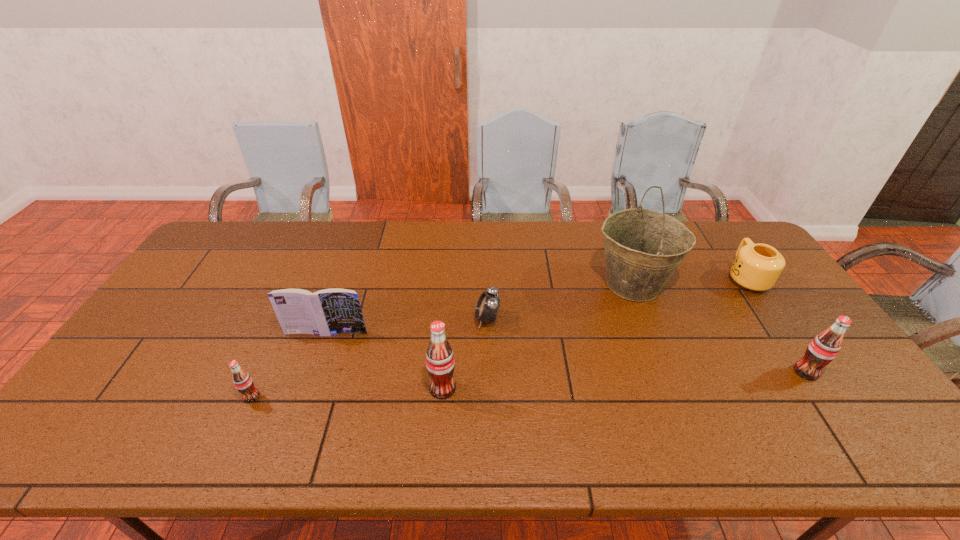
Where is `vacant space located on the right of the second soda from left to right`? Image resolution: width=960 pixels, height=540 pixels. vacant space located on the right of the second soda from left to right is located at coordinates (543, 388).

The height and width of the screenshot is (540, 960). What are the coordinates of `vacant area situated on the left of the second shortest soda` in the screenshot? It's located at (776, 372).

Locate an element on the screen. This screenshot has width=960, height=540. vacant space situated on the left of the tallest object is located at coordinates (522, 285).

Where is `vacant space located on the face of the alarm clock`? The width and height of the screenshot is (960, 540). vacant space located on the face of the alarm clock is located at coordinates (444, 319).

Where is `free region located on the face of the alarm clock`? The height and width of the screenshot is (540, 960). free region located on the face of the alarm clock is located at coordinates (444, 319).

What are the coordinates of `vacant space located on the face of the alarm clock` in the screenshot? It's located at (369, 319).

In order to click on vacant area located on the handle side of the mug in this screenshot , I will do `click(727, 249)`.

Where is `blank space located on the handle side of the mug`? blank space located on the handle side of the mug is located at coordinates (719, 238).

The width and height of the screenshot is (960, 540). I want to click on free space located on the handle side of the mug, so click(728, 252).

Locate an element on the screen. This screenshot has width=960, height=540. vacant region located on the front cover of the fourth shortest object is located at coordinates (310, 381).